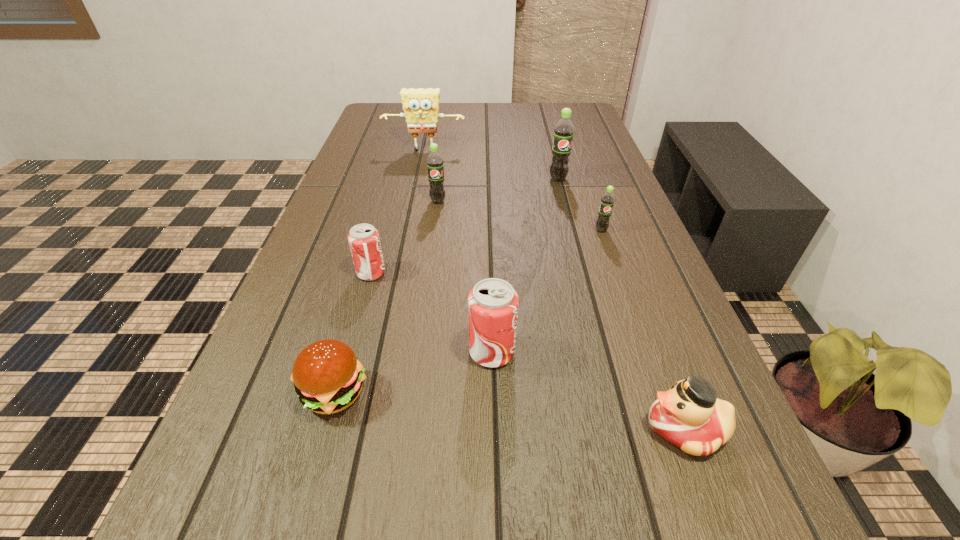
You are a GUI agent. You are given a task and a screenshot of the screen. Output one action in this format:
    pyautogui.click(x=<x>, y=<y>)
    Task: Click on the blank space at the right edge of the desktop
    Image resolution: width=960 pixels, height=540 pixels.
    Given the screenshot: What is the action you would take?
    pyautogui.click(x=590, y=199)

Locate an element on the screen. The image size is (960, 540). vacant space at the far left corner is located at coordinates (401, 120).

The height and width of the screenshot is (540, 960). I want to click on vacant space at the far right corner of the desktop, so click(x=542, y=110).

The image size is (960, 540). In order to click on blank region between the red duck and the brown hamburger in this screenshot , I will do `click(510, 410)`.

What are the coordinates of `empty space that is in between the nearest green soda and the brown hamburger` in the screenshot? It's located at (468, 312).

I want to click on blank region between the fourth nearest object and the red duck, so click(x=528, y=351).

Where is `vacant area that lies between the second smallest green soda and the nearer pink soda can`? This screenshot has width=960, height=540. vacant area that lies between the second smallest green soda and the nearer pink soda can is located at coordinates (465, 277).

Locate an element on the screen. The width and height of the screenshot is (960, 540). vacant region between the fifth object from left to right and the yellow sponge is located at coordinates (458, 252).

Find the location of a particular element. Image resolution: width=960 pixels, height=540 pixels. free area in between the farthest soda and the nearest soda is located at coordinates (525, 266).

Locate an element on the screen. The height and width of the screenshot is (540, 960). free space between the red duck and the leftmost soda is located at coordinates (528, 351).